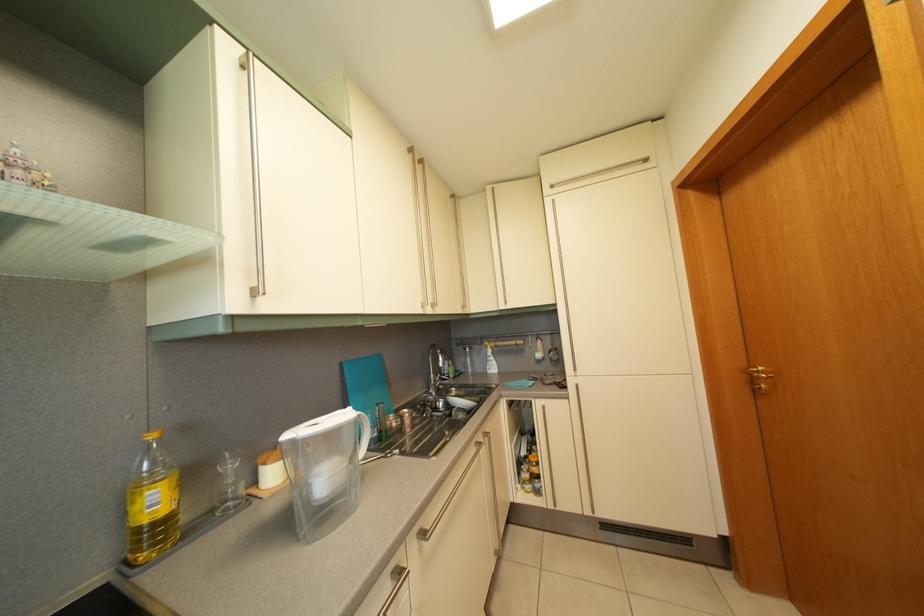
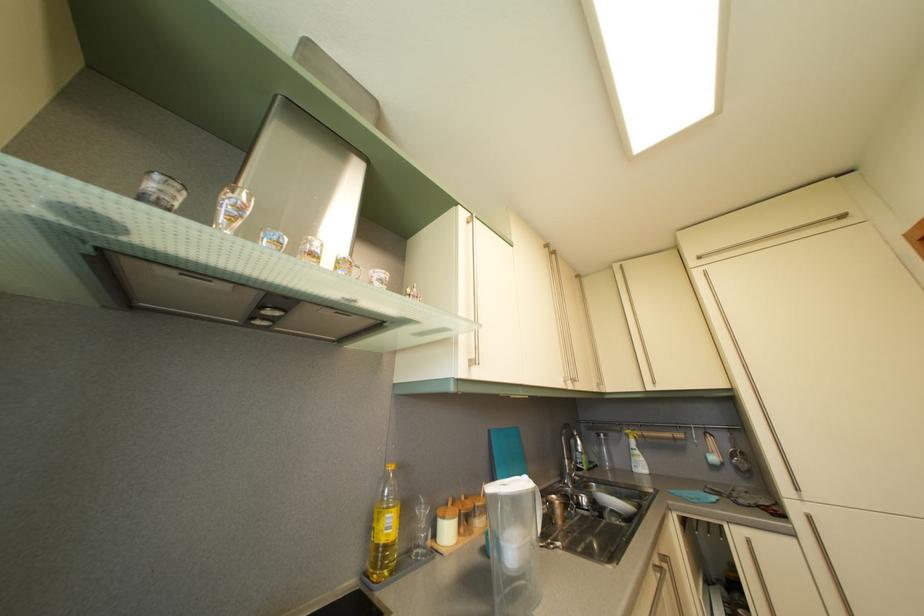
The point at (220,519) is marked in the first image. Where is the corresponding point in the second image?

(417, 560)